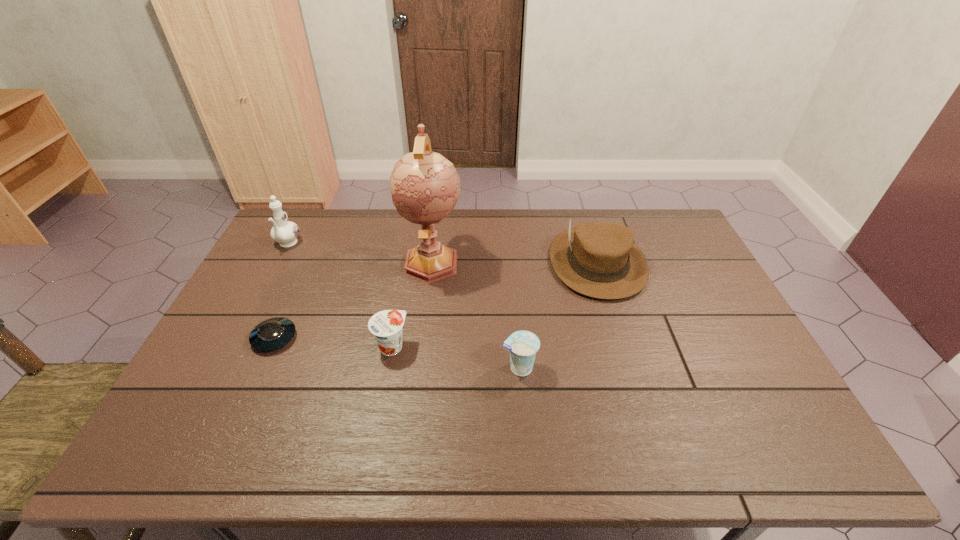
The width and height of the screenshot is (960, 540). In order to click on vacant space located on the back of the left yogurt in this screenshot , I will do `click(400, 302)`.

You are a GUI agent. You are given a task and a screenshot of the screen. Output one action in this format:
    pyautogui.click(x=<x>, y=<y>)
    Task: Click on the vacant space located 0.080m on the right of the saucer
    This screenshot has height=540, width=960.
    Given the screenshot: What is the action you would take?
    pyautogui.click(x=324, y=338)

The image size is (960, 540). I want to click on globe that is at the far edge, so click(x=425, y=186).

Locate an element on the screen. The height and width of the screenshot is (540, 960). chinaware that is at the far edge is located at coordinates (284, 232).

Locate an element on the screen. Image resolution: width=960 pixels, height=540 pixels. fedora present at the far edge is located at coordinates (600, 260).

In order to click on chinaware at the left edge in this screenshot , I will do `click(284, 232)`.

Find the location of a particular element. saucer located in the left edge section of the desktop is located at coordinates pyautogui.click(x=274, y=333).

This screenshot has width=960, height=540. In order to click on object present at the far left corner in this screenshot , I will do `click(284, 232)`.

In the image, there is a desktop. Where is `vacant space at the far edge`? vacant space at the far edge is located at coordinates (529, 219).

Locate an element on the screen. Image resolution: width=960 pixels, height=540 pixels. free spot at the near edge of the desktop is located at coordinates (468, 430).